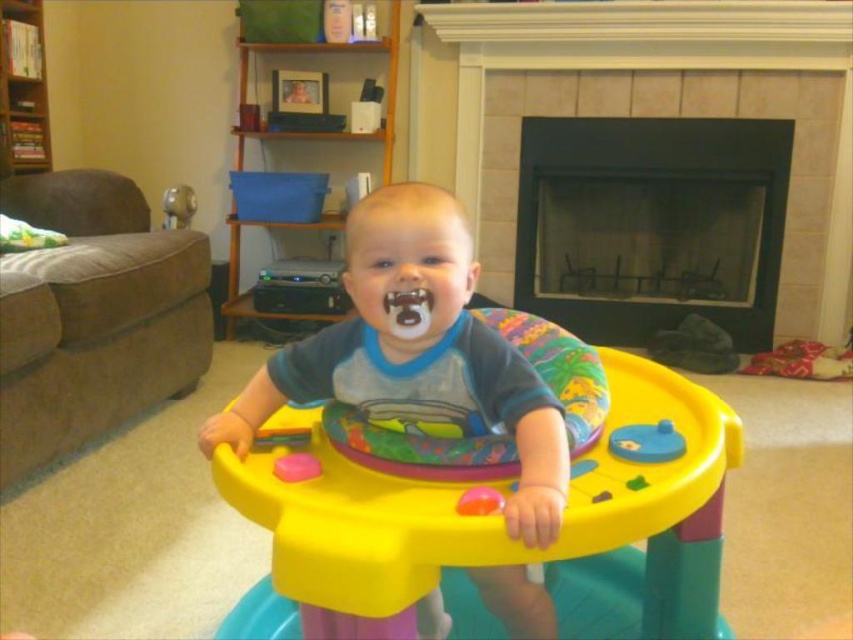
Question: Is brown fabric couch at left positioned in front of rubberized plastic toy at center?

Choices:
 (A) no
 (B) yes

Answer: (A)

Question: Does blue rubber toy at center have a greater width compared to rubberized plastic ball at center?

Choices:
 (A) yes
 (B) no

Answer: (A)

Question: Can you confirm if brown fabric couch at left is positioned to the right of blue rubber toy at center?

Choices:
 (A) yes
 (B) no

Answer: (B)

Question: Among these objects, which one is farthest from the camera?

Choices:
 (A) black tile fireplace at center
 (B) matte plastic walker at center
 (C) brown fabric couch at left

Answer: (A)

Question: Which of the following is the farthest from the observer?

Choices:
 (A) (312, 458)
 (B) (473, 512)

Answer: (A)

Question: Which point is farther from the camera taking this photo?

Choices:
 (A) (660, 444)
 (B) (296, 460)
 (C) (639, 285)
 (D) (474, 230)

Answer: (C)